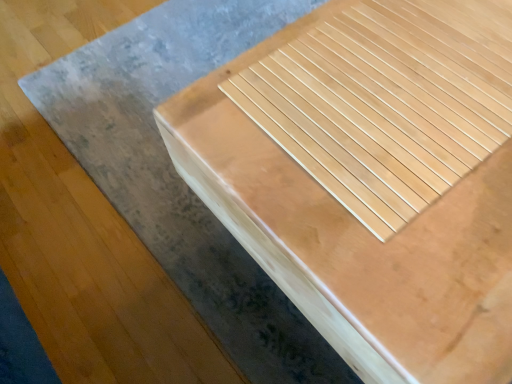
Question: Should I look upward or downward to see natural wood table at center?

Choices:
 (A) down
 (B) up

Answer: (B)